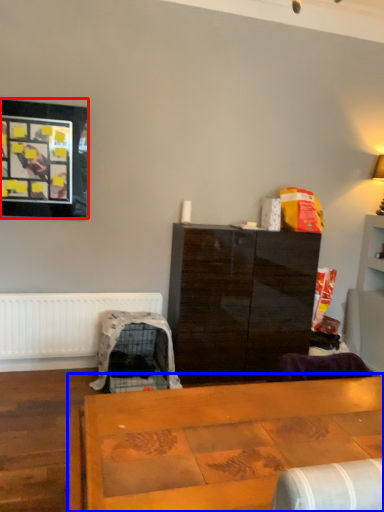
Question: Among these objects, which one is nearest to the camera, picture frame (highlighted by a red box) or table (highlighted by a blue box)?

Choices:
 (A) picture frame
 (B) table

Answer: (B)